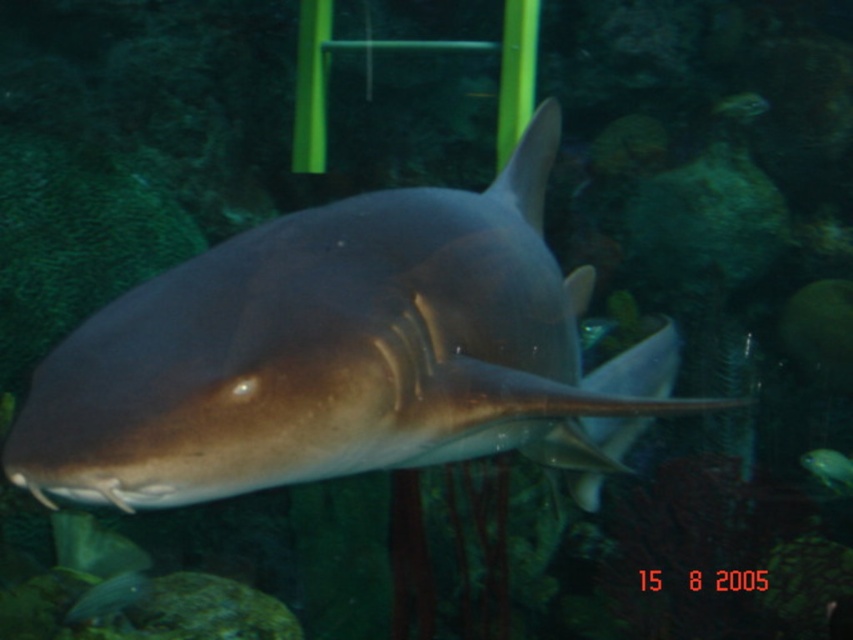
Between smooth gray shark at center and shiny blue fish at center, which one has less height?

shiny blue fish at center

Between point (86, 486) and point (822, 480), which one is positioned in front?

Point (86, 486) is in front.

Between point (148, 332) and point (814, 477), which one is positioned in front?

Positioned in front is point (148, 332).

I want to click on smooth gray shark at center, so click(x=329, y=353).

Is point (114, 595) positioned behind point (833, 456)?

No, it is in front of (833, 456).

Which is more to the right, shiny silver fish at lower left or shiny blue fish at center?

Positioned to the right is shiny blue fish at center.

Where is `shiny silver fish at lower left`? The width and height of the screenshot is (853, 640). shiny silver fish at lower left is located at coordinates (108, 596).

Who is taller, smooth gray shark at center or shiny silver fish at lower left?

smooth gray shark at center is taller.

Is smooth gray shark at center wider than shiny silver fish at lower left?

Yes, smooth gray shark at center is wider than shiny silver fish at lower left.

Measure the distance between smooth gray shark at center and camera.

smooth gray shark at center and camera are 30.93 inches apart.

This screenshot has width=853, height=640. I want to click on smooth gray shark at center, so click(x=329, y=353).